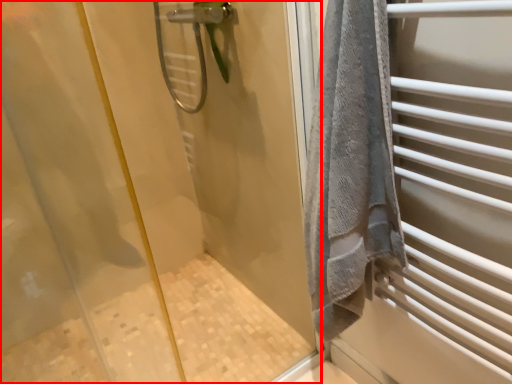
Question: Observing the image, what is the correct spatial positioning of screen door (annotated by the red box) in reference to shower?

Choices:
 (A) right
 (B) left

Answer: (A)